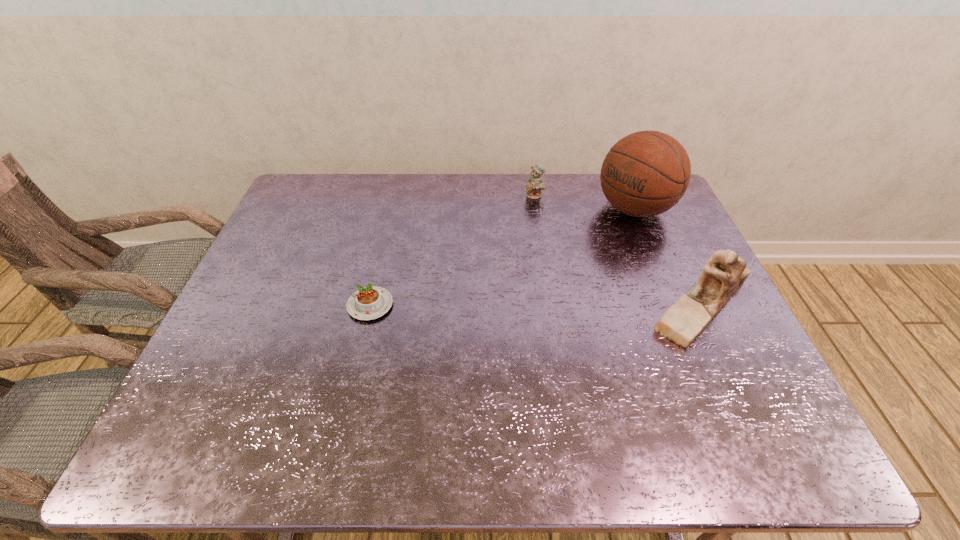
Where is `free spot on the desktop that is between the leftmost object and the second tallest object and is positioned on the side with brand label of the tallest object`? free spot on the desktop that is between the leftmost object and the second tallest object and is positioned on the side with brand label of the tallest object is located at coordinates pos(492,305).

The image size is (960, 540). Find the location of `free space on the desktop that is between the shortest object and the second tallest object and is positioned on the front-facing side of the second object from left to right`. free space on the desktop that is between the shortest object and the second tallest object and is positioned on the front-facing side of the second object from left to right is located at coordinates (509, 305).